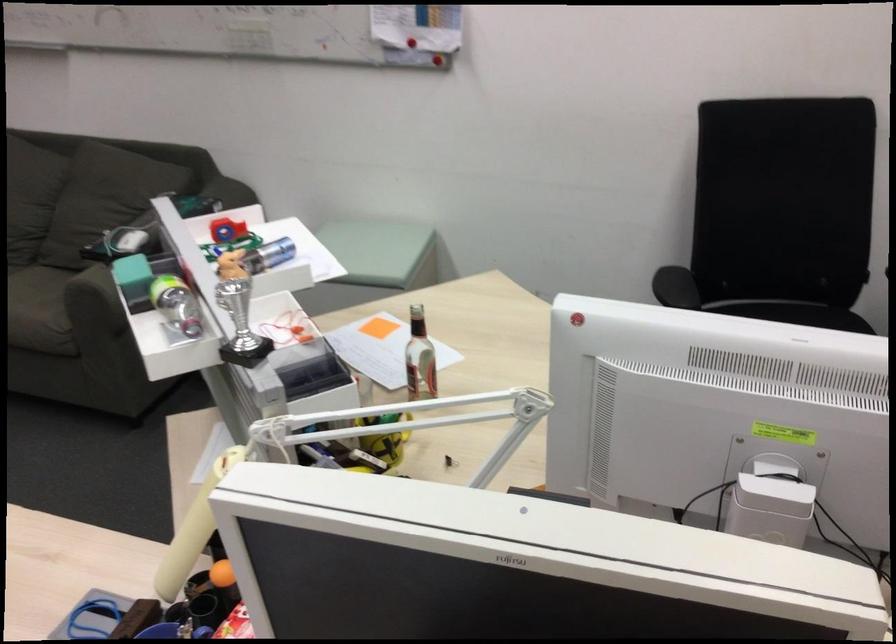
The location [221,230] corresponds to which object?

It corresponds to the red tape dispenser in the image.